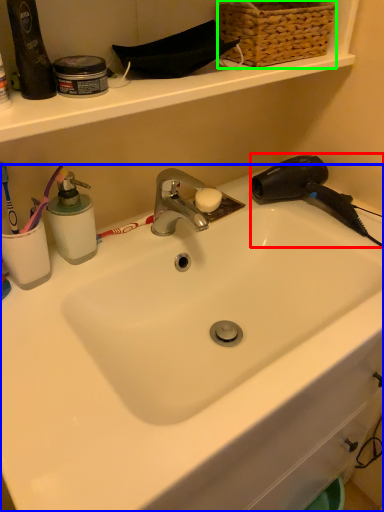
Question: Considering the real-world distances, which object is farthest from hair drier (highlighted by a red box)? sink (highlighted by a blue box) or basket (highlighted by a green box)?

Choices:
 (A) sink
 (B) basket

Answer: (A)